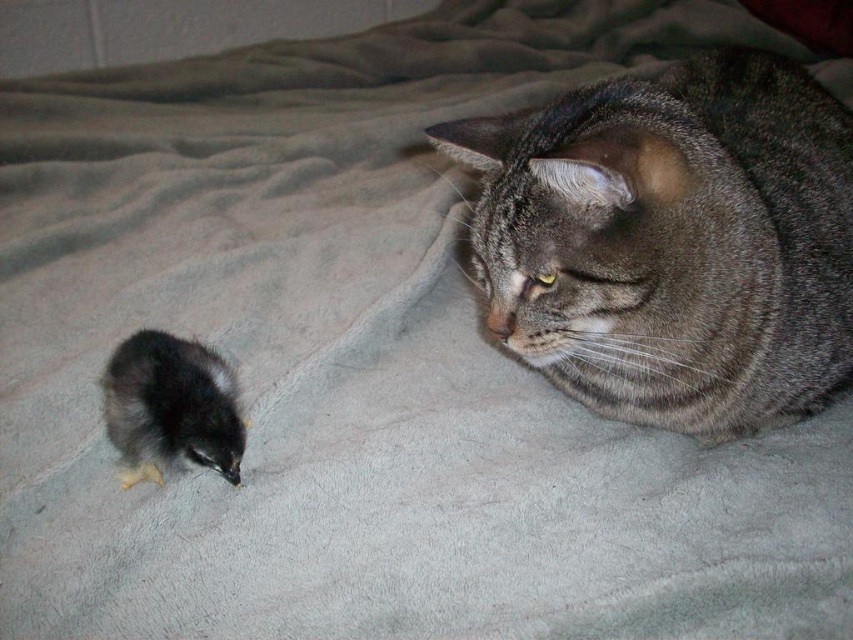
Question: Can you confirm if gray tabby cat at upper right is positioned to the left of fluffy black bird at lower left?

Choices:
 (A) no
 (B) yes

Answer: (A)

Question: Which of the following is the closest to the observer?

Choices:
 (A) gray tabby cat at upper right
 (B) fluffy black bird at lower left

Answer: (A)

Question: Which point is farther from the camera taking this photo?

Choices:
 (A) [x=757, y=160]
 (B) [x=131, y=337]

Answer: (B)

Question: Which point is farther from the camera taking this photo?

Choices:
 (A) (790, 236)
 (B) (201, 458)

Answer: (A)

Question: Is gray tabby cat at upper right below fluffy black bird at lower left?

Choices:
 (A) yes
 (B) no

Answer: (B)

Question: Can you confirm if gray tabby cat at upper right is bigger than fluffy black bird at lower left?

Choices:
 (A) no
 (B) yes

Answer: (B)